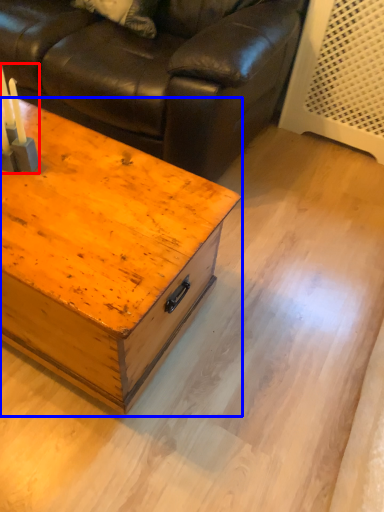
Question: Which object is closer to the camera taking this photo, candle holder (highlighted by a red box) or table (highlighted by a blue box)?

Choices:
 (A) candle holder
 (B) table

Answer: (B)